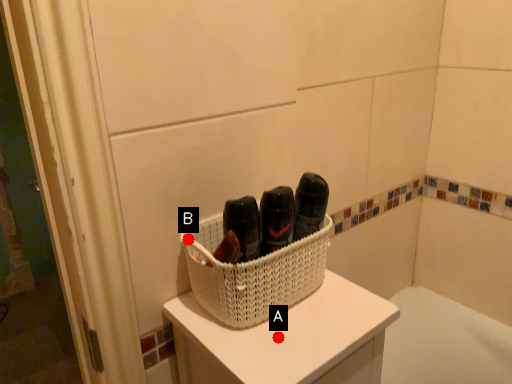
Question: Two points are circled on the image, labeled by A and B beside each circle. Which point is closer to the camera?

Choices:
 (A) A is closer
 (B) B is closer

Answer: (A)